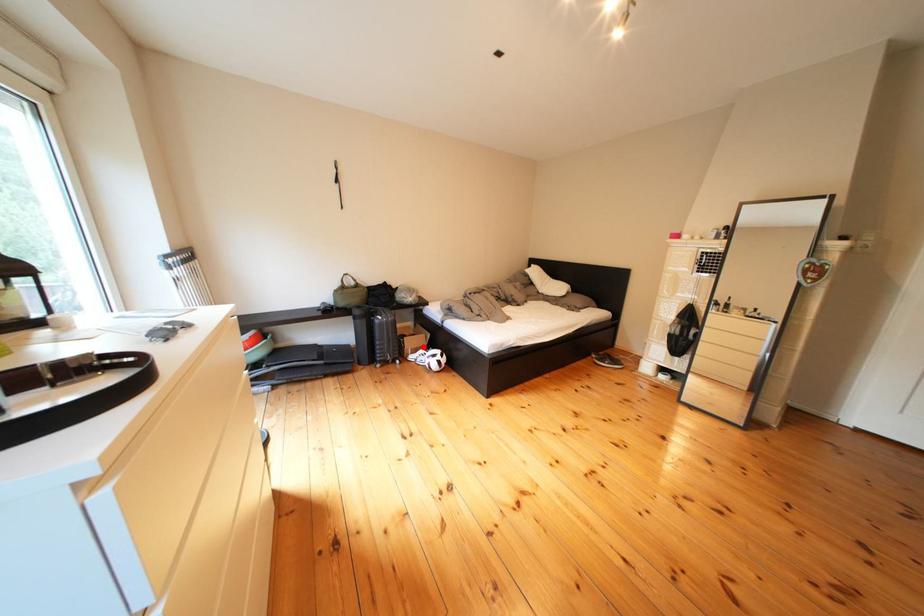
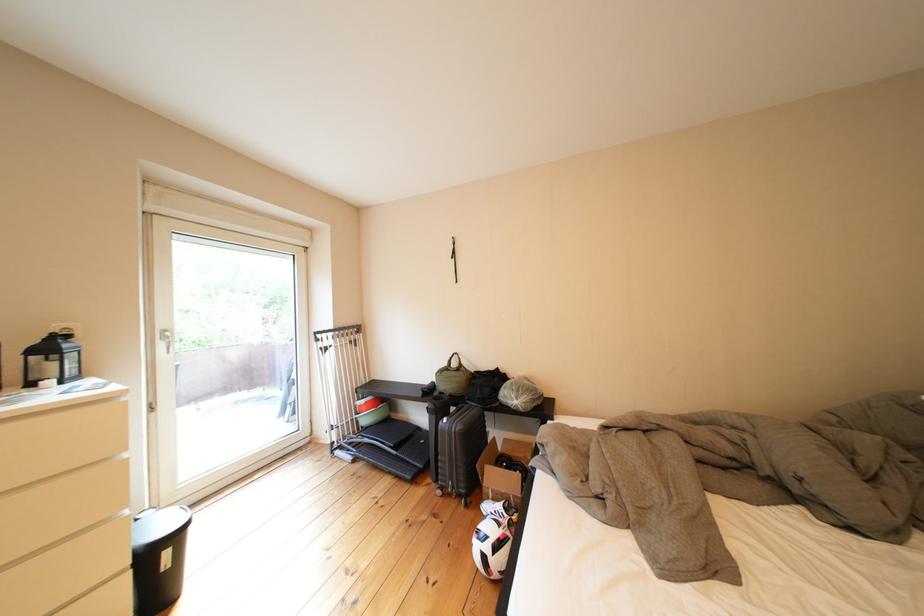
Question: I am providing you with two images of the same scene from different viewpoints. In image1, a red point is highlighted. Considering the same 3D point in image2, which of the following is correct?

Choices:
 (A) It is closer
 (B) It is farther

Answer: (A)